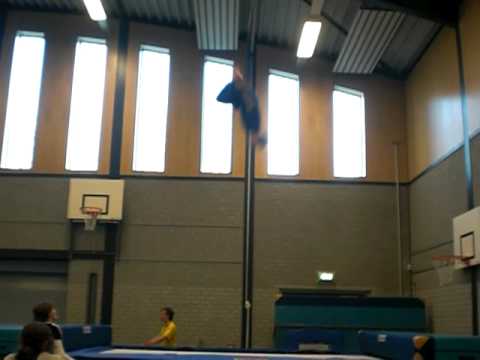
This screenshot has height=360, width=480. I want to click on padding, so [353, 308], [356, 344].